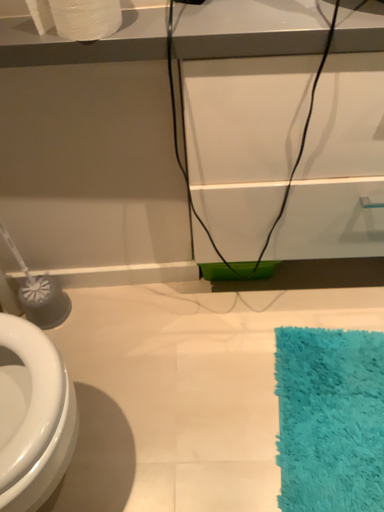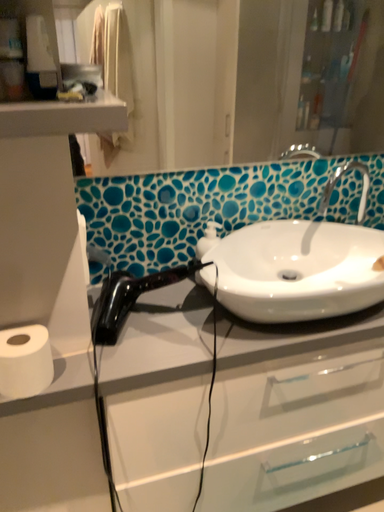
Question: Which way did the camera rotate in the video?

Choices:
 (A) rotated left
 (B) rotated right

Answer: (B)